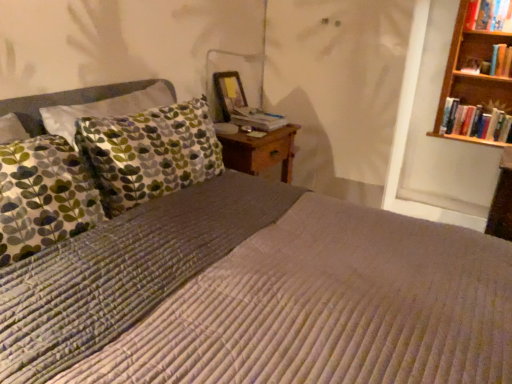
Question: Considering the relative sizes of hardcover book at center and hardcover books at right, the third book from the top, in the image provided, is hardcover book at center bigger than hardcover books at right, the third book from the top,?

Choices:
 (A) no
 (B) yes

Answer: (A)

Question: From the image's perspective, is hardcover book at center over hardcover books at right, the 1th book ordered from the bottom?

Choices:
 (A) no
 (B) yes

Answer: (A)

Question: Is hardcover book at center turned away from hardcover books at right, the 1th book ordered from the bottom?

Choices:
 (A) yes
 (B) no

Answer: (B)

Question: Considering the relative sizes of hardcover book at center and hardcover books at right, the third book from the top, in the image provided, is hardcover book at center thinner than hardcover books at right, the third book from the top,?

Choices:
 (A) yes
 (B) no

Answer: (B)

Question: Does hardcover book at center have a greater height compared to hardcover books at right, the 1th book ordered from the bottom?

Choices:
 (A) no
 (B) yes

Answer: (A)

Question: Is hardcover book at center facing towards hardcover books at right, the 1th book ordered from the bottom?

Choices:
 (A) yes
 (B) no

Answer: (B)

Question: Is hardcover book at upper right, which is the first book in top-to-bottom order, at the right side of matte wooden picture frame at upper center?

Choices:
 (A) yes
 (B) no

Answer: (A)

Question: Considering the relative sizes of hardcover book at upper right, acting as the third book starting from the bottom, and matte wooden picture frame at upper center in the image provided, is hardcover book at upper right, acting as the third book starting from the bottom, taller than matte wooden picture frame at upper center?

Choices:
 (A) yes
 (B) no

Answer: (B)

Question: Considering the relative sizes of hardcover book at upper right, acting as the third book starting from the bottom, and matte wooden picture frame at upper center in the image provided, is hardcover book at upper right, acting as the third book starting from the bottom, bigger than matte wooden picture frame at upper center?

Choices:
 (A) no
 (B) yes

Answer: (B)

Question: From the image's perspective, is hardcover book at upper right, which is the first book in top-to-bottom order, above matte wooden picture frame at upper center?

Choices:
 (A) no
 (B) yes

Answer: (B)

Question: From a real-world perspective, is hardcover book at upper right, which is the first book in top-to-bottom order, on top of matte wooden picture frame at upper center?

Choices:
 (A) yes
 (B) no

Answer: (A)

Question: From a real-world perspective, does hardcover book at upper right, which is the first book in top-to-bottom order, sit lower than matte wooden picture frame at upper center?

Choices:
 (A) no
 (B) yes

Answer: (A)

Question: Is hardcover book at upper right, which ranks as the 2th book in top-to-bottom order, surrounding hardcover book at upper right, which is the first book in top-to-bottom order?

Choices:
 (A) yes
 (B) no

Answer: (B)